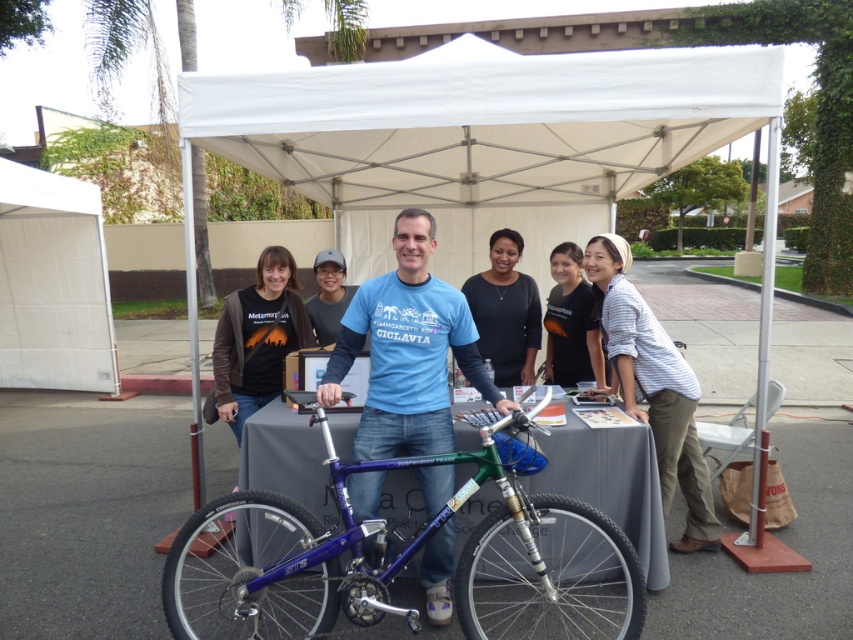
You are planning to set up a similar table under the white fabric canopy at left. Given that the matte gray shirt at center is worn by a person of average height, can the canopy accommodate a standard table that fits six people comfortably?

The white fabric canopy at left has a width larger than the matte gray shirt at center, which is worn by an average height person. This suggests the canopy is spacious enough to accommodate a standard table for six people comfortably.

You are organizing a photo shoot and need to arrange the striped shirt at lower right and the black matte shirt at center in a way that accommodates their sizes. Which shirt should be placed in a wider area to fit comfortably?

The striped shirt at lower right should be placed in a wider area because its width is larger than the black matte shirt at center.

You are a photographer positioned at the back of the group. You want to take a photo of the matte gray shirt at center and the white fabric canopy at left. Which object will appear taller in the photo?

The white fabric canopy at left will appear taller in the photo because it is taller than the matte gray shirt at center according to the description.